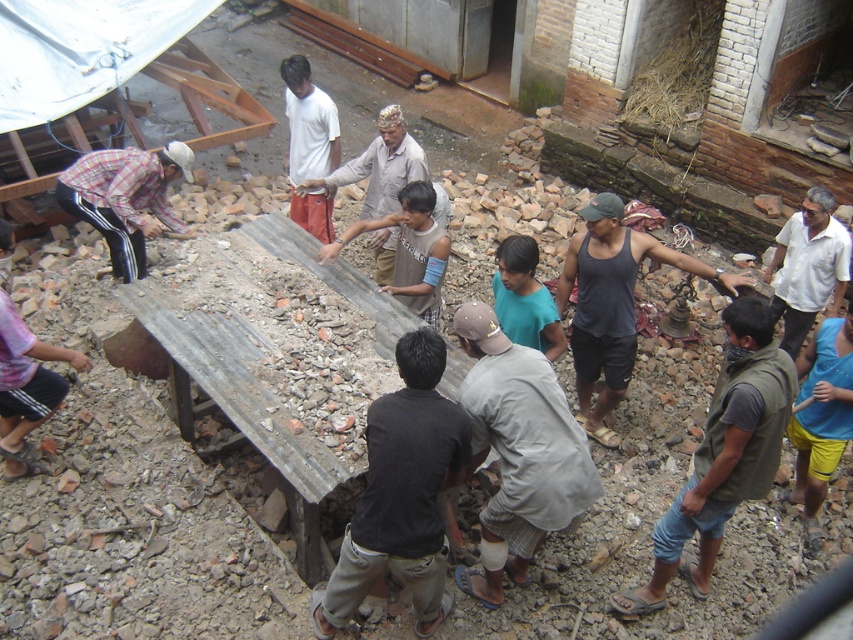
Is point (398, 436) positioned in front of point (811, 260)?

Yes, it is.

How much distance is there between black cotton shirt at center and white cotton shirt at right?

3.76 meters

You are a GUI agent. You are given a task and a screenshot of the screen. Output one action in this format:
    pyautogui.click(x=<x>, y=<y>)
    Task: Click on the black cotton shirt at center
    The height and width of the screenshot is (640, 853).
    Given the screenshot: What is the action you would take?
    pyautogui.click(x=401, y=492)

Who is positioned more to the right, green fabric vest at lower right or pink fabric shirt at lower left?

From the viewer's perspective, green fabric vest at lower right appears more on the right side.

Who is shorter, green fabric vest at lower right or pink fabric shirt at lower left?

pink fabric shirt at lower left is shorter.

Locate an element on the screen. This screenshot has width=853, height=640. green fabric vest at lower right is located at coordinates (723, 456).

Does black cotton shirt at center appear under brown fabric shirt at center?

Indeed, black cotton shirt at center is positioned under brown fabric shirt at center.

Is black cotton shirt at center shorter than brown fabric shirt at center?

No, black cotton shirt at center is not shorter than brown fabric shirt at center.

Find the location of a particular element. The height and width of the screenshot is (640, 853). black cotton shirt at center is located at coordinates (401, 492).

The width and height of the screenshot is (853, 640). In order to click on black cotton shirt at center in this screenshot , I will do `click(401, 492)`.